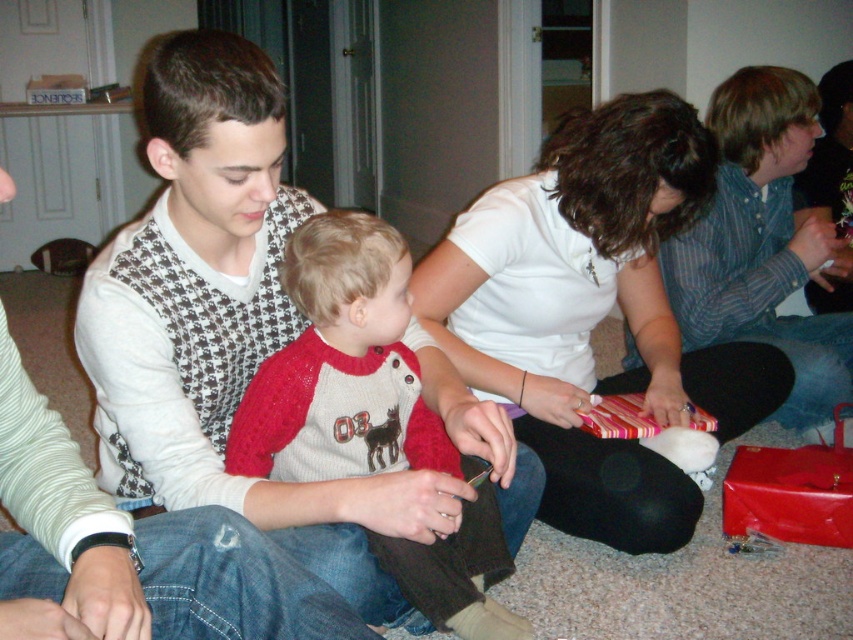
You are organizing a gift exchange and need to determine the order of participants based on their clothing layers. The white matte shirt at center and the white sweater vest at center are both visible. Which clothing item is closer to the observer?

The white matte shirt at center is positioned over the white sweater vest at center, so the white matte shirt at center is closer to the observer.

You are trying to decide which sweater to take from the center area. The red knit sweater at center and the white sweater vest at center are both in the middle. Which one is positioned to the right?

The red knit sweater at center is to the right of the white sweater vest at center, so you should choose the red knit sweater at center if you want the one on the right.